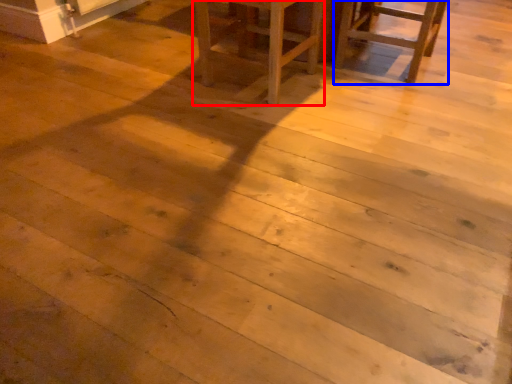
Question: Which object appears farthest to the camera in this image, furniture (highlighted by a red box) or chair (highlighted by a blue box)?

Choices:
 (A) furniture
 (B) chair

Answer: (B)